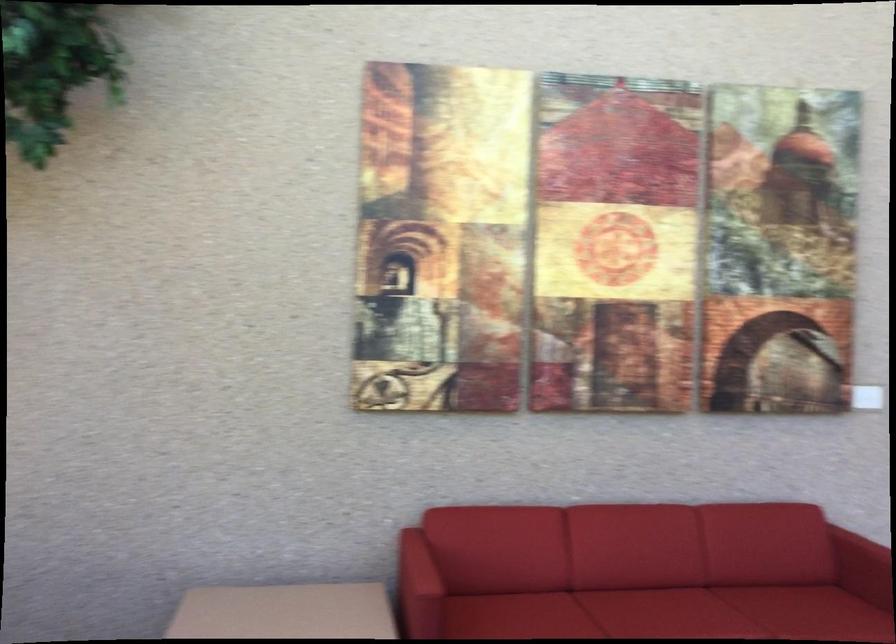
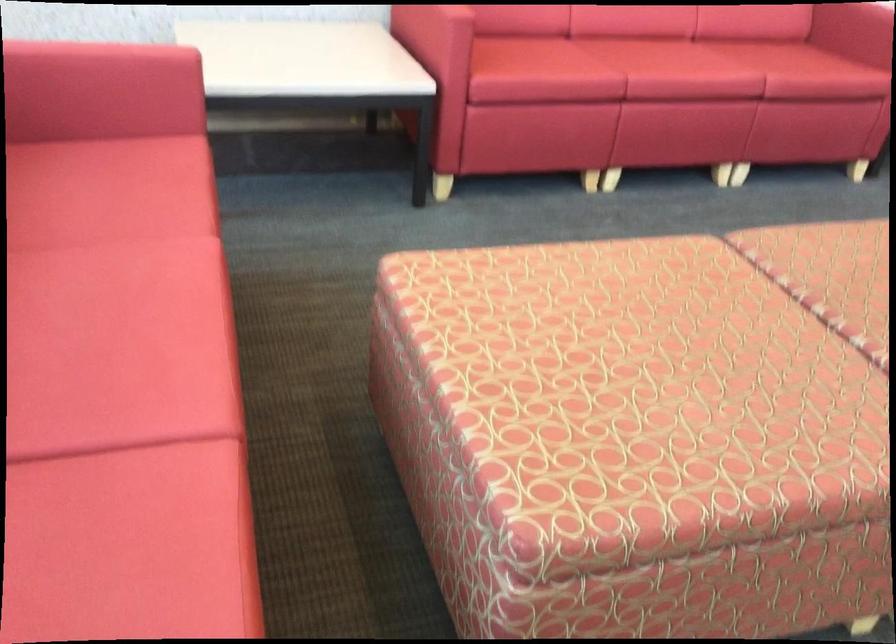
Question: Based on the continuous images, in which direction is the camera rotating? Reply with the corresponding letter.

Choices:
 (A) Left
 (B) Right
 (C) Up
 (D) Down

Answer: (D)